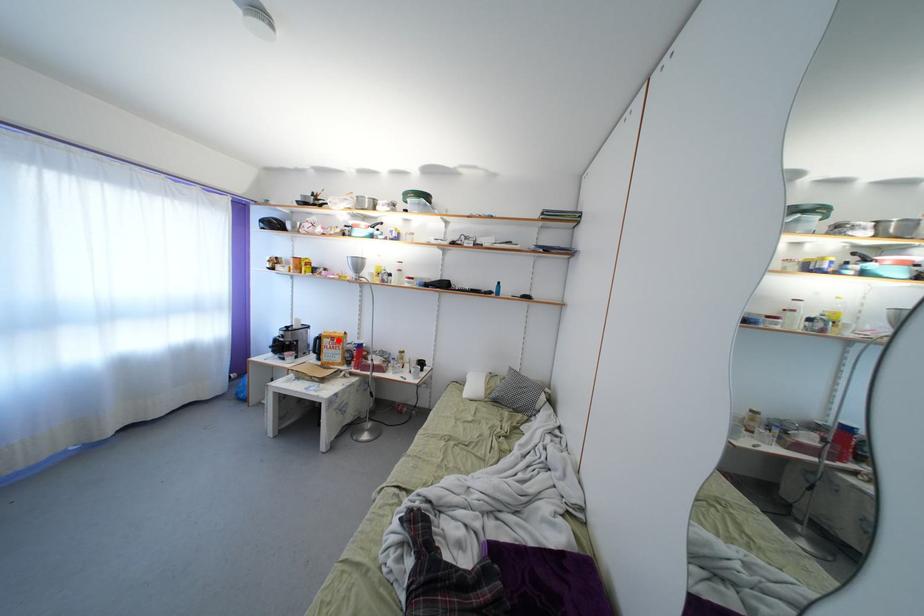
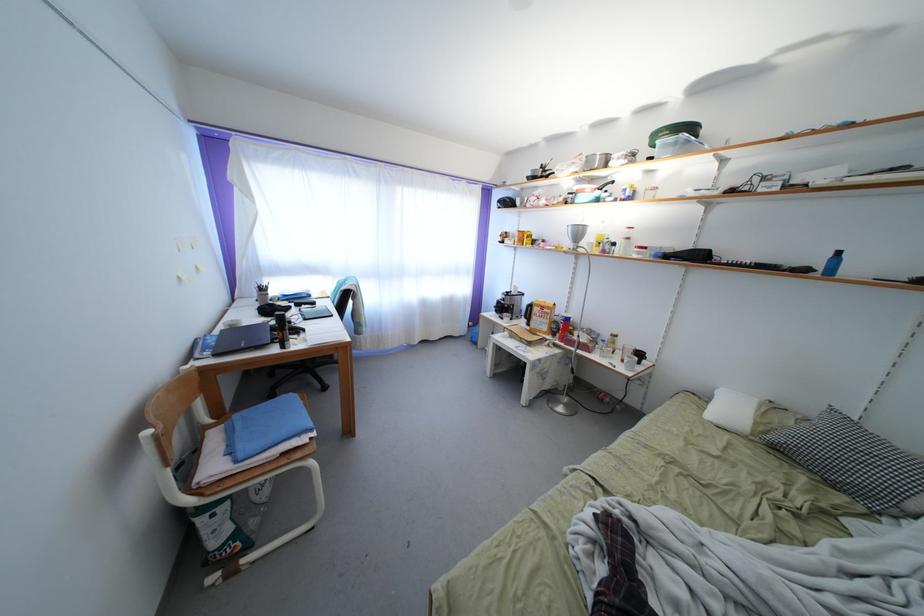
Question: I am providing you with two images of the same scene from different viewpoints. A red point is shown in image1. For the corresponding object point in image2, is it positioned nearer or farther from the camera?

Choices:
 (A) Nearer
 (B) Farther

Answer: (A)